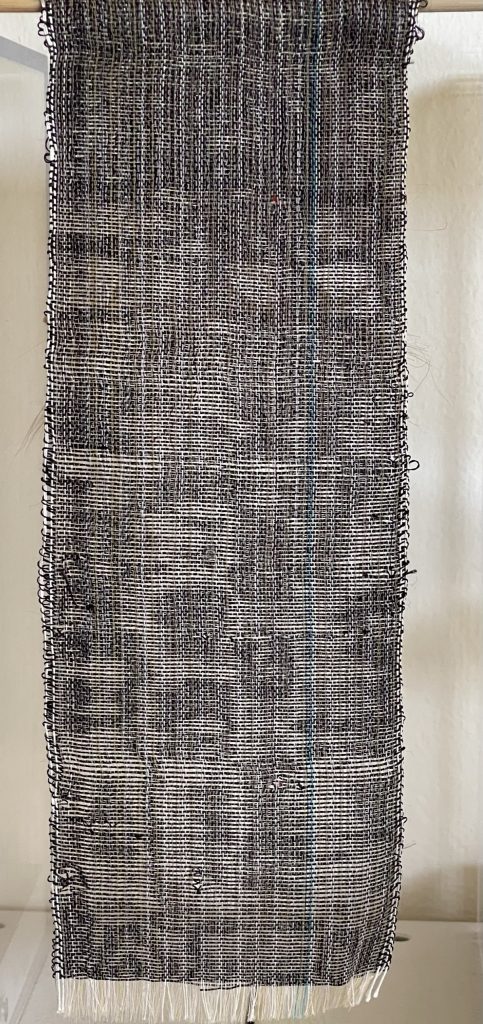
Where is `white countertop`? white countertop is located at coordinates (436, 978).